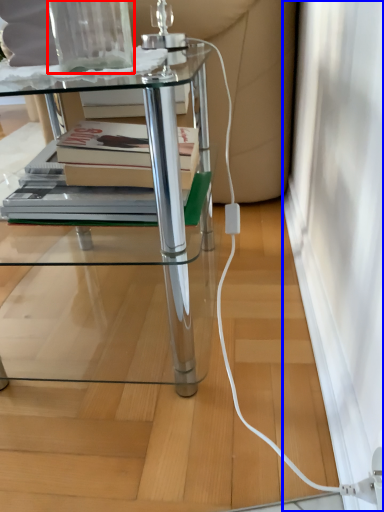
Question: Which point is closer to the camera, glass vase (highlighted by a red box) or screen door (highlighted by a blue box)?

Choices:
 (A) glass vase
 (B) screen door

Answer: (A)